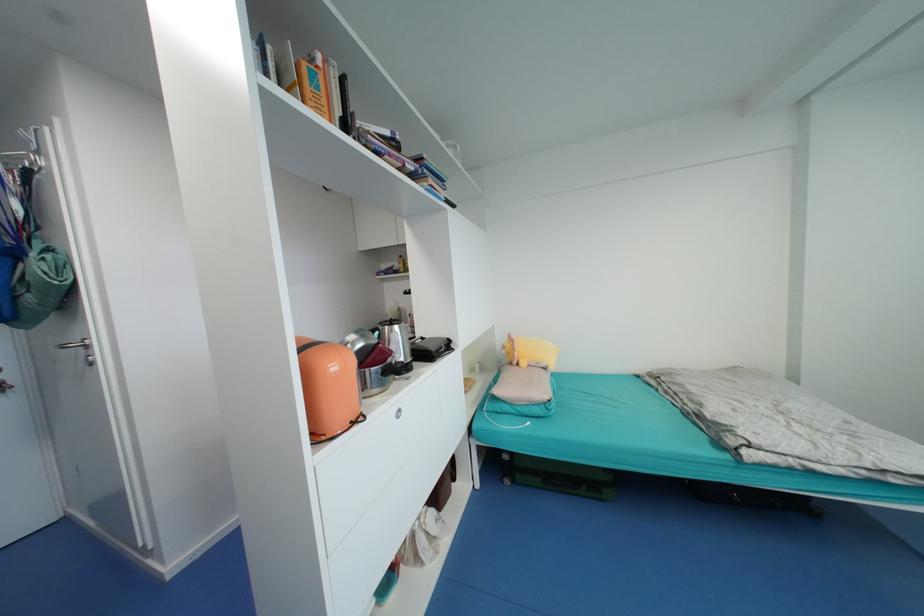
Where would you lift the black kettle handle? Please return your answer as a coordinate pair (x, y).

(391, 371)